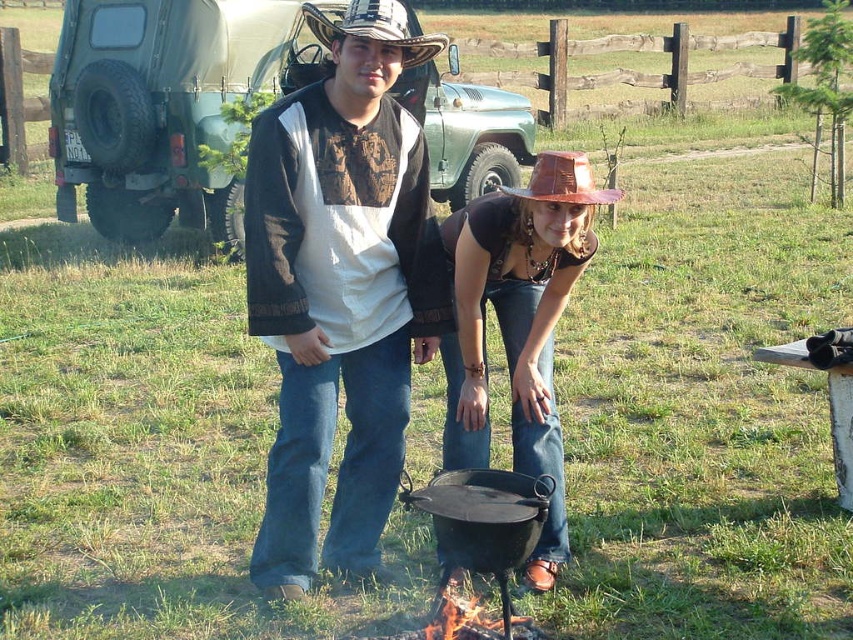
You are standing in the rural setting shown in the scene. You need to locate the shiny brown hat at center. Where exactly is it positioned in terms of coordinates?

The shiny brown hat at center is located at coordinates point (518, 324).

You are a photographer trying to capture both the shiny brown hat at center and the brown leather cowboy hat at center in a single shot. Which hat will appear closer to the camera in the photo?

The shiny brown hat at center will appear closer to the camera because it is positioned in front of the brown leather cowboy hat at center.